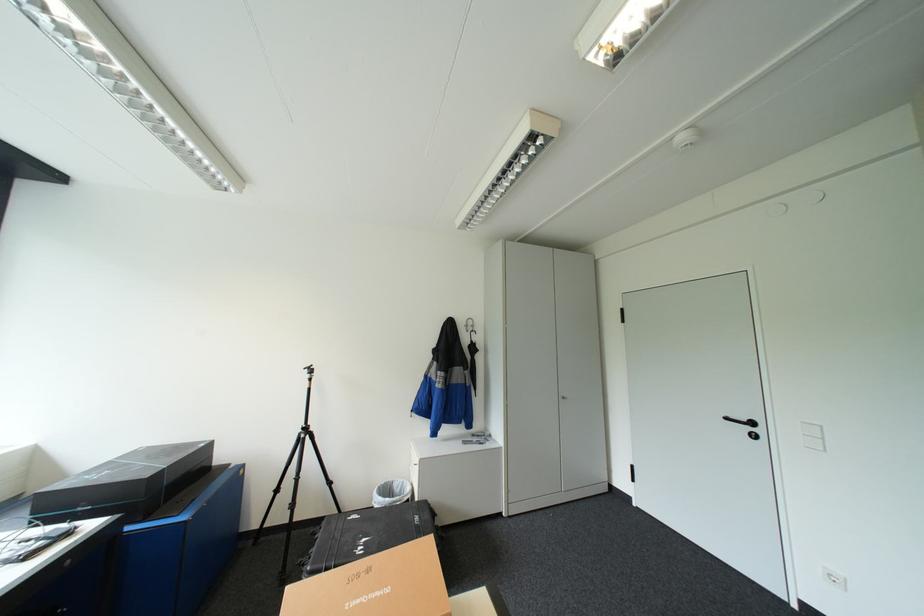
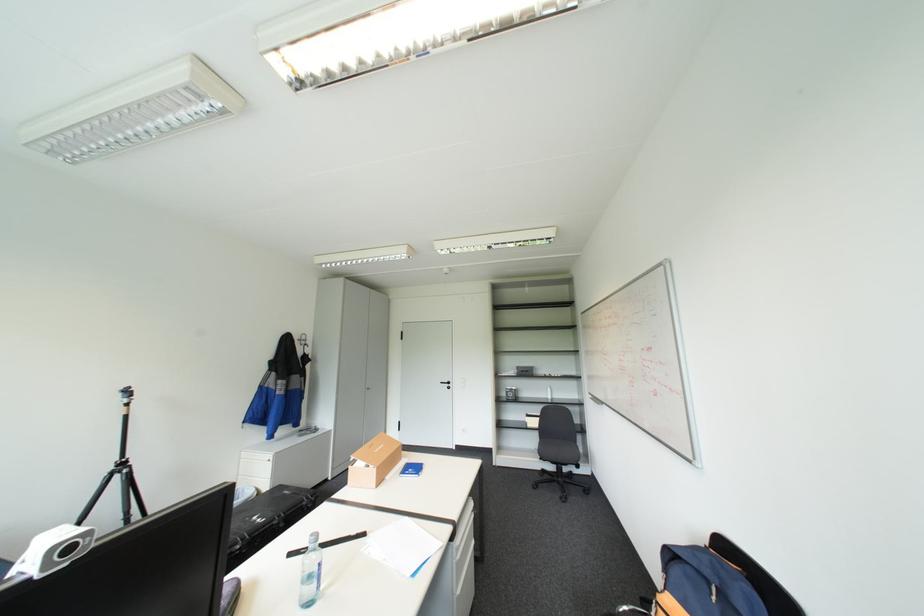
Where in the second image is the point corresponding to [426,466] from the first image?

(278, 461)